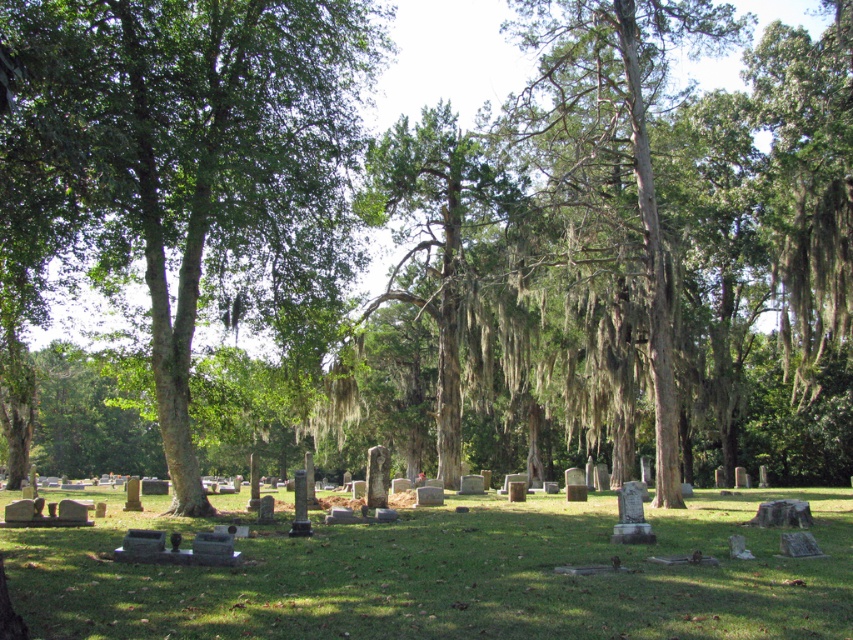
You are standing at the entrance of the cemetery and see two points marked in the image. Which point, point (434, 518) or point (549, 205), is closer to you?

Point (434, 518) is closer to the camera than point (549, 205), so it is closer to you.

You are standing in the cemetery and want to place a new flowerpot at the base of the green mossy bark tree at center. However, there is already a gray concrete tombstones at center nearby. Based on their positions, can you place the flowerpot directly under the tree without it being blocked by the tombstone?

The gray concrete tombstones at center is located below the green mossy bark tree at center, so placing the flowerpot directly under the tree would place it right at the base of the tombstone. Therefore, the flowerpot would be blocked by the tombstone and not visible under the tree.

You are standing at the camera position in the cemetery scene. You want to walk to the point labeled as point (270, 200). How far will you have to walk?

The distance between the camera and point (270, 200) is 20.80 meters, so you will have to walk 20.80 meters to reach it.